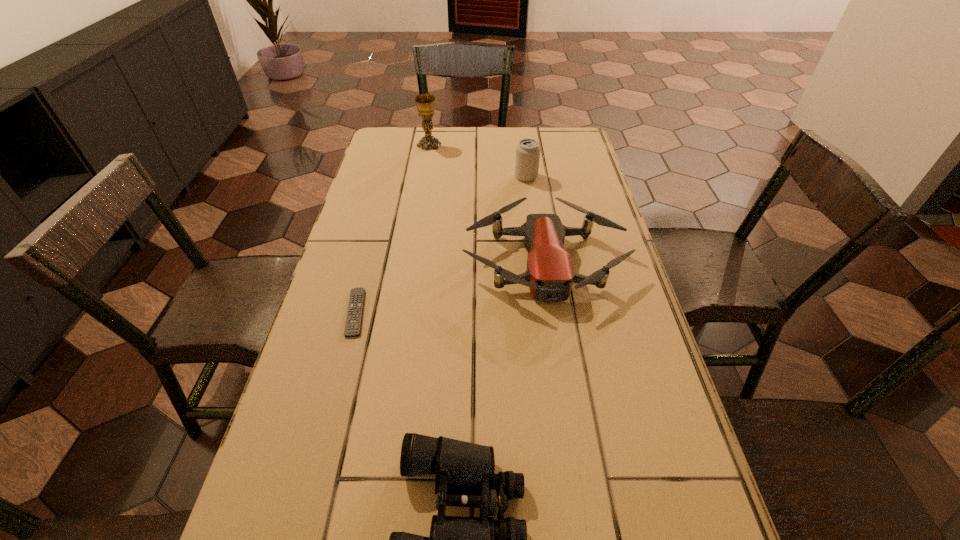
This screenshot has height=540, width=960. In order to click on vacant region located 0.080m on the back of the shortest object in this screenshot , I will do 368,267.

I want to click on object at the far edge, so click(425, 103).

The image size is (960, 540). In order to click on chalice located in the left edge section of the desktop in this screenshot , I will do 425,103.

The width and height of the screenshot is (960, 540). I want to click on remote control present at the left edge, so click(353, 324).

You are a GUI agent. You are given a task and a screenshot of the screen. Output one action in this format:
    pyautogui.click(x=<x>, y=<y>)
    Task: Click on the object that is at the right edge
    The image size is (960, 540).
    Given the screenshot: What is the action you would take?
    pyautogui.click(x=550, y=274)

Identify the location of object that is at the far left corner. (425, 103).

In the image, there is a desktop. At what (x,y) coordinates should I click in order to perform the action: click on vacant space at the far edge. Please return your answer as a coordinate pair (x, y). Image resolution: width=960 pixels, height=540 pixels. Looking at the image, I should click on (515, 149).

In the image, there is a desktop. Identify the location of blank space at the left edge. Image resolution: width=960 pixels, height=540 pixels. (360, 351).

I want to click on vacant space at the right edge of the desktop, so click(x=582, y=183).

Locate an element on the screen. Image resolution: width=960 pixels, height=540 pixels. vacant space at the far left corner of the desktop is located at coordinates (377, 144).